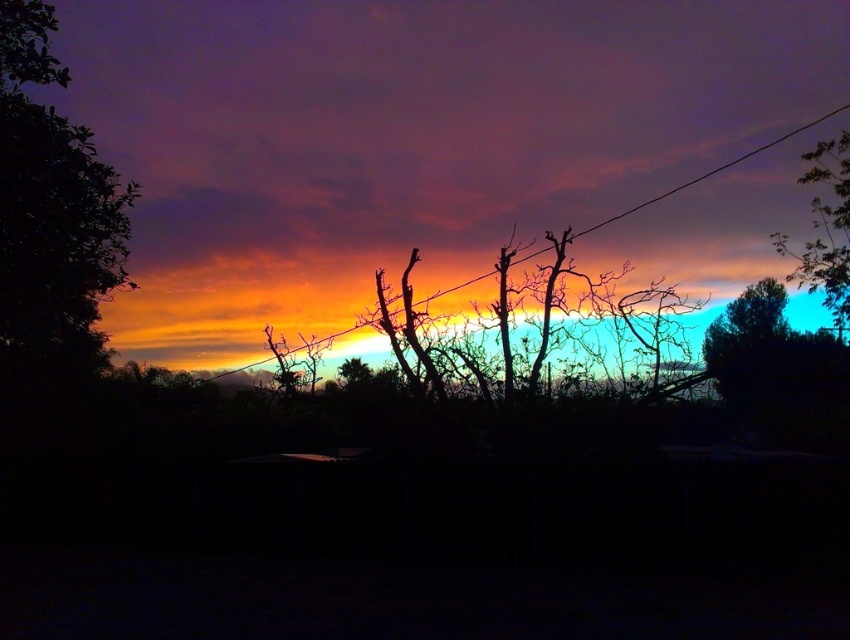
Does green leafy tree at left have a greater height compared to green leafy tree at upper right?

Yes, green leafy tree at left is taller than green leafy tree at upper right.

Between point (34, 266) and point (847, 237), which one is positioned behind?

The point (847, 237) is behind.

Locate an element on the screen. Image resolution: width=850 pixels, height=640 pixels. green leafy tree at left is located at coordinates click(x=51, y=216).

Who is higher up, green leafy tree at left or orange matte power line at center?

Positioned higher is green leafy tree at left.

Which is behind, point (81, 192) or point (540, 248)?

Positioned behind is point (540, 248).

Who is more forward, (97, 200) or (786, 138)?

Positioned in front is point (97, 200).

This screenshot has height=640, width=850. Identify the location of green leafy tree at left. (51, 216).

Is silhouette bare branches at center to the left of green leafy tree at upper right from the viewer's perspective?

Yes, silhouette bare branches at center is to the left of green leafy tree at upper right.

What do you see at coordinates (585, 316) in the screenshot? I see `silhouette bare branches at center` at bounding box center [585, 316].

Where is `silhouette bare branches at center`? This screenshot has height=640, width=850. silhouette bare branches at center is located at coordinates (585, 316).